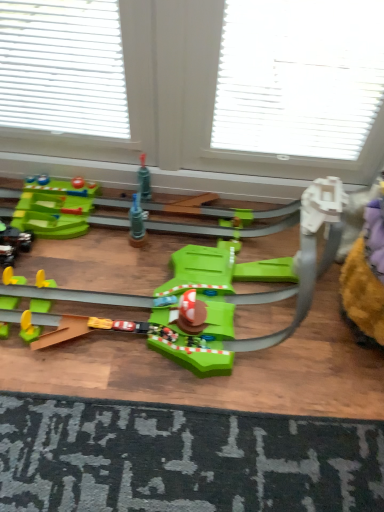
Describe the element at coordinates (204, 302) in the screenshot. I see `green plastic toy at center, the 2th toy in the back-to-front sequence` at that location.

Measure the distance between shiny black car at left, which is counted as the second toy, starting from the front, and camera.

The depth of shiny black car at left, which is counted as the second toy, starting from the front, is 1.31 meters.

Find the location of a particular element. The height and width of the screenshot is (512, 384). green plastic toy at center, the 2th toy in the back-to-front sequence is located at coordinates (204, 302).

Measure the distance from dark gray textured doormat at bottom to green plastic toy at center, the 2th toy viewed from the left.

A distance of 11.14 inches exists between dark gray textured doormat at bottom and green plastic toy at center, the 2th toy viewed from the left.

Which of these two, dark gray textured doormat at bottom or green plastic toy at center, the 1th toy from the right, is bigger?

With larger size is green plastic toy at center, the 1th toy from the right.

Does point (364, 504) come behind point (143, 305)?

No, it is not.

Can you confirm if dark gray textured doormat at bottom is thinner than green plastic toy at center, placed as the second toy when sorted from bottom to top?

In fact, dark gray textured doormat at bottom might be wider than green plastic toy at center, placed as the second toy when sorted from bottom to top.

Does shiny black car at left, the first toy in the bottom-to-top sequence, have a lesser width compared to green plastic toy at center, the 2th toy viewed from the left?

Yes.

From the image's perspective, is shiny black car at left, acting as the 1th toy starting from the left, below green plastic toy at center, the 2th toy in the back-to-front sequence?

Answer: Yes.

From a real-world perspective, is shiny black car at left, the first toy in the bottom-to-top sequence, physically located above or below green plastic toy at center, placed as the second toy when sorted from bottom to top?

From a real-world perspective, shiny black car at left, the first toy in the bottom-to-top sequence, is physically below green plastic toy at center, placed as the second toy when sorted from bottom to top.

Is shiny black car at left, the first toy in the bottom-to-top sequence, positioned behind green plastic toy at center, the 2th toy viewed from the left?

Yes, shiny black car at left, the first toy in the bottom-to-top sequence, is further from the viewer.

Visually, is shiny black car at left, arranged as the 2th toy when viewed from the top, positioned to the left or to the right of dark gray textured doormat at bottom?

shiny black car at left, arranged as the 2th toy when viewed from the top, is positioned on dark gray textured doormat at bottom's left side.

From the image's perspective, is shiny black car at left, the first toy positioned from the back, positioned above or below dark gray textured doormat at bottom?

shiny black car at left, the first toy positioned from the back, is situated higher than dark gray textured doormat at bottom in the image.

At what (x,y) coordinates should I click in order to perform the action: click on toy behind the dark gray textured doormat at bottom. Please return your answer as a coordinate pair (x, y). The height and width of the screenshot is (512, 384). Looking at the image, I should click on (13, 243).

From a real-world perspective, is shiny black car at left, acting as the 1th toy starting from the left, positioned under dark gray textured doormat at bottom based on gravity?

Yes, from a real-world perspective, shiny black car at left, acting as the 1th toy starting from the left, is under dark gray textured doormat at bottom.

From a real-world perspective, which object stands above the other?

green plastic toy at center, positioned as the 1th toy in top-to-bottom order.

Does green plastic toy at center, arranged as the 1th toy when viewed from the front, contain dark gray textured doormat at bottom?

That's incorrect, dark gray textured doormat at bottom is not inside green plastic toy at center, arranged as the 1th toy when viewed from the front.

From the image's perspective, between green plastic toy at center, the 2th toy viewed from the left, and dark gray textured doormat at bottom, who is located below?

From the image's view, dark gray textured doormat at bottom is below.

Between green plastic toy at center, the 1th toy from the right, and shiny black car at left, arranged as the 2th toy when viewed from the top, which one appears on the right side from the viewer's perspective?

From the viewer's perspective, green plastic toy at center, the 1th toy from the right, appears more on the right side.

Looking at their sizes, would you say green plastic toy at center, placed as the second toy when sorted from bottom to top, is wider or thinner than shiny black car at left, acting as the 1th toy starting from the left?

green plastic toy at center, placed as the second toy when sorted from bottom to top, is wider than shiny black car at left, acting as the 1th toy starting from the left.

Who is shorter, green plastic toy at center, arranged as the 1th toy when viewed from the front, or shiny black car at left, the second toy from the right?

Standing shorter between the two is shiny black car at left, the second toy from the right.

Is the depth of green plastic toy at center, the 2th toy in the back-to-front sequence, less than that of shiny black car at left, the first toy positioned from the back?

Yes, the depth of green plastic toy at center, the 2th toy in the back-to-front sequence, is less than that of shiny black car at left, the first toy positioned from the back.

Can you confirm if dark gray textured doormat at bottom is smaller than shiny black car at left, the first toy in the bottom-to-top sequence?

No, dark gray textured doormat at bottom is not smaller than shiny black car at left, the first toy in the bottom-to-top sequence.

Which of these two, dark gray textured doormat at bottom or shiny black car at left, acting as the 1th toy starting from the left, stands taller?

shiny black car at left, acting as the 1th toy starting from the left.

In the scene shown: Is dark gray textured doormat at bottom not inside shiny black car at left, acting as the 1th toy starting from the left?

Yes, dark gray textured doormat at bottom is not within shiny black car at left, acting as the 1th toy starting from the left.

Between point (151, 417) and point (29, 241), which one is positioned behind?

The point (29, 241) is farther from the camera.

You are a GUI agent. You are given a task and a screenshot of the screen. Output one action in this format:
    pyautogui.click(x=<x>, y=<y>)
    Task: Click on the toy that is the 2nd one when counting upward from the dark gray textured doormat at bottom (from the image's perspective)
    
    Given the screenshot: What is the action you would take?
    pyautogui.click(x=204, y=302)

I want to click on toy located above the shiny black car at left, the second toy from the right (from a real-world perspective), so click(204, 302).

From the image, which object appears to be nearer to green plastic toy at center, placed as the second toy when sorted from bottom to top, shiny black car at left, the first toy in the bottom-to-top sequence, or dark gray textured doormat at bottom?

dark gray textured doormat at bottom is positioned closer to the anchor green plastic toy at center, placed as the second toy when sorted from bottom to top.

From the picture: Which object lies nearer to the anchor point green plastic toy at center, the 1th toy from the right, dark gray textured doormat at bottom or shiny black car at left, arranged as the 2th toy when viewed from the top?

dark gray textured doormat at bottom is positioned closer to the anchor green plastic toy at center, the 1th toy from the right.

Estimate the real-world distances between objects in this image. Which object is further from dark gray textured doormat at bottom, shiny black car at left, which is counted as the second toy, starting from the front, or green plastic toy at center, the 2th toy viewed from the left?

The object further to dark gray textured doormat at bottom is shiny black car at left, which is counted as the second toy, starting from the front.

Estimate the real-world distances between objects in this image. Which object is further from dark gray textured doormat at bottom, green plastic toy at center, the 1th toy from the right, or shiny black car at left, the first toy positioned from the back?

shiny black car at left, the first toy positioned from the back, lies further to dark gray textured doormat at bottom than the other object.

When comparing their distances from shiny black car at left, arranged as the 2th toy when viewed from the top, does dark gray textured doormat at bottom or green plastic toy at center, arranged as the 1th toy when viewed from the front, seem closer?

Based on the image, green plastic toy at center, arranged as the 1th toy when viewed from the front, appears to be nearer to shiny black car at left, arranged as the 2th toy when viewed from the top.

Based on their spatial positions, is green plastic toy at center, positioned as the 1th toy in top-to-bottom order, or dark gray textured doormat at bottom closer to shiny black car at left, arranged as the 2th toy when viewed from the top?

green plastic toy at center, positioned as the 1th toy in top-to-bottom order, is positioned closer to the anchor shiny black car at left, arranged as the 2th toy when viewed from the top.

What are the coordinates of `toy between green plastic toy at center, the 1th toy from the right, and dark gray textured doormat at bottom, in the vertical direction` in the screenshot? It's located at (13, 243).